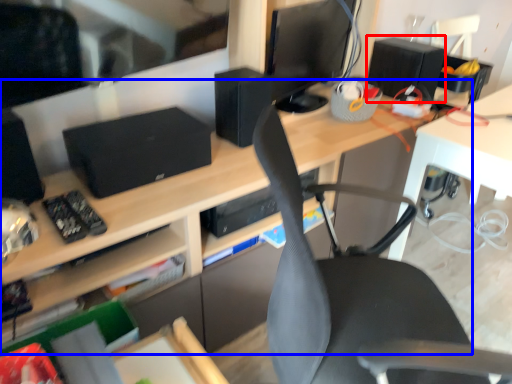
Question: Which of the following is the farthest to the observer, speaker (highlighted by a red box) or desk (highlighted by a blue box)?

Choices:
 (A) speaker
 (B) desk

Answer: (A)